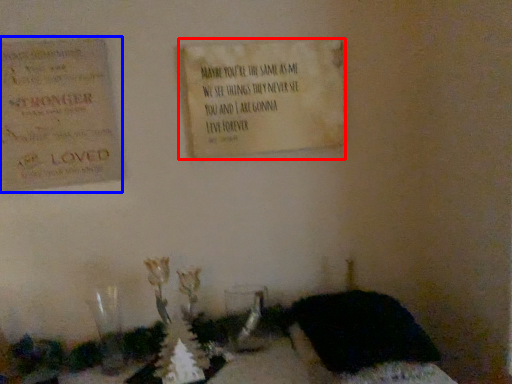
Question: Which object is further to the camera taking this photo, notice (highlighted by a red box) or cardboard (highlighted by a blue box)?

Choices:
 (A) notice
 (B) cardboard

Answer: (A)